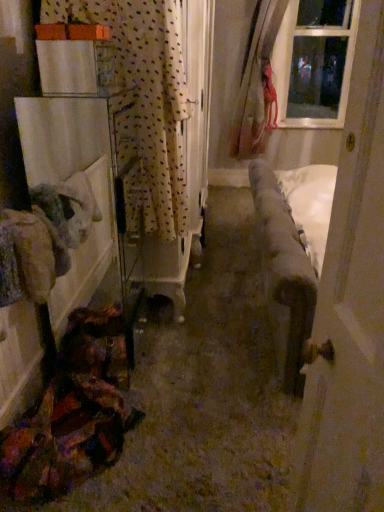
Locate an element on the screen. This screenshot has height=512, width=384. clear glass window at upper right is located at coordinates (x=315, y=62).

You are a GUI agent. You are given a task and a screenshot of the screen. Output one action in this format:
    pyautogui.click(x=<x>, y=<y>)
    Task: Click on the velvet fabric couch at center
    This screenshot has width=384, height=512.
    Given the screenshot: What is the action you would take?
    pyautogui.click(x=205, y=391)

Where is `white polka dot fabric at left`? This screenshot has height=512, width=384. white polka dot fabric at left is located at coordinates (143, 103).

Locate an element on the screen. wooden door at right is located at coordinates (351, 308).

Is wooden door at right next to clear glass window at upper right?

There is a gap between wooden door at right and clear glass window at upper right.

Considering the sizes of wooden door at right and clear glass window at upper right in the image, is wooden door at right bigger or smaller than clear glass window at upper right?

Clearly, wooden door at right is smaller in size than clear glass window at upper right.

How many degrees apart are the facing directions of wooden door at right and clear glass window at upper right?

83.4 degrees.

Could you tell me if wooden door at right is turned towards clear glass window at upper right?

No, wooden door at right is not facing towards clear glass window at upper right.

Would you say clear glass window at upper right is outside wooden door at right?

That's correct, clear glass window at upper right is outside of wooden door at right.

Considering the relative sizes of clear glass window at upper right and wooden door at right in the image provided, is clear glass window at upper right taller than wooden door at right?

No, clear glass window at upper right is not taller than wooden door at right.

Considering the relative sizes of clear glass window at upper right and wooden door at right in the image provided, is clear glass window at upper right thinner than wooden door at right?

In fact, clear glass window at upper right might be wider than wooden door at right.

Considering the positions of objects clear glass window at upper right and wooden door at right in the image provided, who is in front, clear glass window at upper right or wooden door at right?

wooden door at right.

From a real-world perspective, which object rests below the other?

velvet fabric couch at center, from a real-world perspective.

You are a GUI agent. You are given a task and a screenshot of the screen. Output one action in this format:
    pyautogui.click(x=<x>, y=<y>)
    Task: Click on the path directly beneath the white polka dot fabric at left (from a real-world perspective)
    The width and height of the screenshot is (384, 512).
    Given the screenshot: What is the action you would take?
    pyautogui.click(x=205, y=391)

Is there a large distance between white polka dot fabric at left and velvet fabric couch at center?

No, white polka dot fabric at left is not far away from velvet fabric couch at center.

Is velvet fabric couch at center closer to the viewer compared to clear glass window at upper right?

Yes, velvet fabric couch at center is closer to the camera.

Consider the image. How many degrees apart are the facing directions of velvet fabric couch at center and clear glass window at upper right?

There is a 89.8-degree angle between the facing directions of velvet fabric couch at center and clear glass window at upper right.

From the image's perspective, who appears lower, velvet fabric couch at center or clear glass window at upper right?

From the image's view, velvet fabric couch at center is below.

Identify the location of window that is above the velvet fabric couch at center (from a real-world perspective). This screenshot has height=512, width=384. (315, 62).

Which is farther, (342, 312) or (131, 86)?

The point (131, 86) is farther.

Looking at this image, in terms of height, does wooden door at right look taller or shorter compared to white polka dot fabric at left?

Considering their sizes, wooden door at right has more height than white polka dot fabric at left.

There is a wooden door at right. At what (x,y) coordinates should I click in order to perform the action: click on curtain above it (from a real-world perspective). Please return your answer as a coordinate pair (x, y). The width and height of the screenshot is (384, 512). Looking at the image, I should click on (143, 103).

From the image's perspective, is wooden door at right under white polka dot fabric at left?

Indeed, from the image's perspective, wooden door at right is shown beneath white polka dot fabric at left.

Can you confirm if clear glass window at upper right is positioned to the left of white polka dot fabric at left?

In fact, clear glass window at upper right is to the right of white polka dot fabric at left.

Is clear glass window at upper right positioned before white polka dot fabric at left?

No, it is not.

Which object is wider, clear glass window at upper right or white polka dot fabric at left?

With larger width is clear glass window at upper right.

Who is shorter, clear glass window at upper right or white polka dot fabric at left?

white polka dot fabric at left.

Between point (306, 437) and point (272, 510), which one is positioned behind?

The point (272, 510) is behind.

Considering the sizes of wooden door at right and velvet fabric couch at center in the image, is wooden door at right taller or shorter than velvet fabric couch at center?

In the image, wooden door at right appears to be taller than velvet fabric couch at center.

Which object is positioned more to the left, wooden door at right or velvet fabric couch at center?

Positioned to the left is velvet fabric couch at center.

In the image, is wooden door at right positioned in front of or behind velvet fabric couch at center?

wooden door at right is positioned closer to the viewer than velvet fabric couch at center.

Find the location of a particular element. window that appears on the right of wooden door at right is located at coordinates (315, 62).

You are a GUI agent. You are given a task and a screenshot of the screen. Output one action in this format:
    pyautogui.click(x=<x>, y=<y>)
    Task: Click on the window lying above the wooden door at right (from the image's perspective)
    
    Given the screenshot: What is the action you would take?
    pyautogui.click(x=315, y=62)

Considering their positions, is wooden door at right positioned closer to white polka dot fabric at left than velvet fabric couch at center?

velvet fabric couch at center lies closer to white polka dot fabric at left than the other object.

Estimate the real-world distances between objects in this image. Which object is closer to white polka dot fabric at left, wooden door at right or clear glass window at upper right?

The object closer to white polka dot fabric at left is wooden door at right.

From the picture: Estimate the real-world distances between objects in this image. Which object is further from clear glass window at upper right, velvet fabric couch at center or wooden door at right?

wooden door at right is further to clear glass window at upper right.

Which object lies nearer to the anchor point wooden door at right, clear glass window at upper right or velvet fabric couch at center?

Based on the image, velvet fabric couch at center appears to be nearer to wooden door at right.

When comparing their distances from wooden door at right, does velvet fabric couch at center or clear glass window at upper right seem closer?

Based on the image, velvet fabric couch at center appears to be nearer to wooden door at right.

Based on their spatial positions, is clear glass window at upper right or white polka dot fabric at left closer to velvet fabric couch at center?

white polka dot fabric at left lies closer to velvet fabric couch at center than the other object.

Estimate the real-world distances between objects in this image. Which object is further from clear glass window at upper right, velvet fabric couch at center or white polka dot fabric at left?

white polka dot fabric at left is positioned further to the anchor clear glass window at upper right.

From the picture: When comparing their distances from white polka dot fabric at left, does velvet fabric couch at center or wooden door at right seem closer?

velvet fabric couch at center lies closer to white polka dot fabric at left than the other object.

Image resolution: width=384 pixels, height=512 pixels. I want to click on path between wooden door at right and clear glass window at upper right in the front-back direction, so click(205, 391).

The height and width of the screenshot is (512, 384). Identify the location of curtain positioned between wooden door at right and clear glass window at upper right from near to far. point(143,103).

The width and height of the screenshot is (384, 512). In order to click on curtain located between velvet fabric couch at center and clear glass window at upper right in the depth direction in this screenshot , I will do `click(143, 103)`.

Locate an element on the screen. Image resolution: width=384 pixels, height=512 pixels. path between wooden door at right and white polka dot fabric at left in the front-back direction is located at coordinates (205, 391).